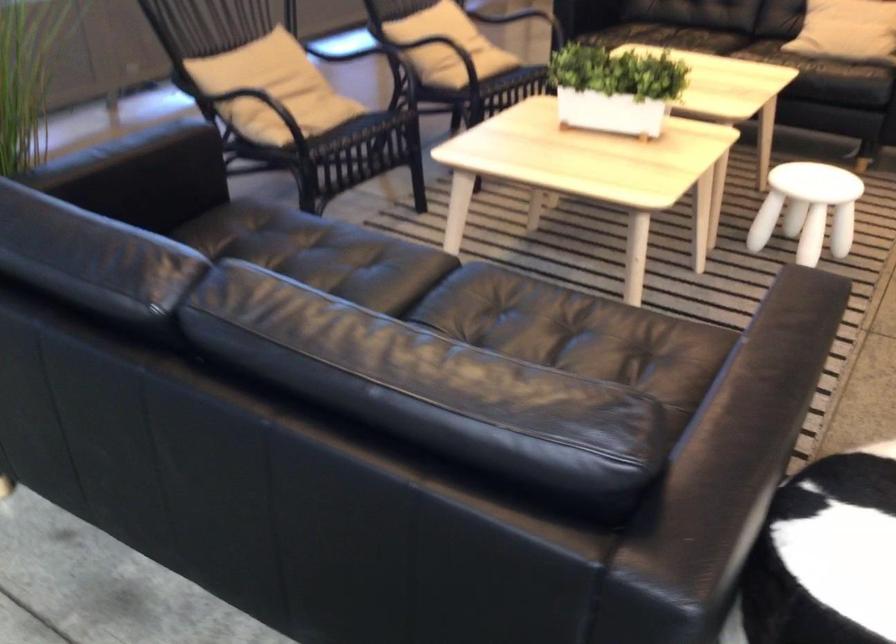
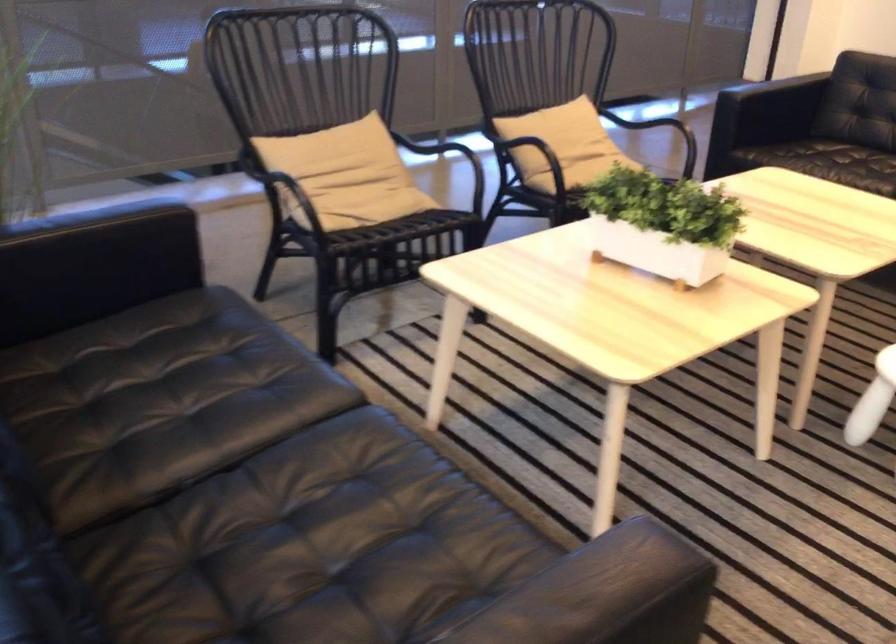
Question: Based on the continuous images, in which direction is the camera rotating? Reply with the corresponding letter.

Choices:
 (A) Left
 (B) Right
 (C) Up
 (D) Down

Answer: (A)